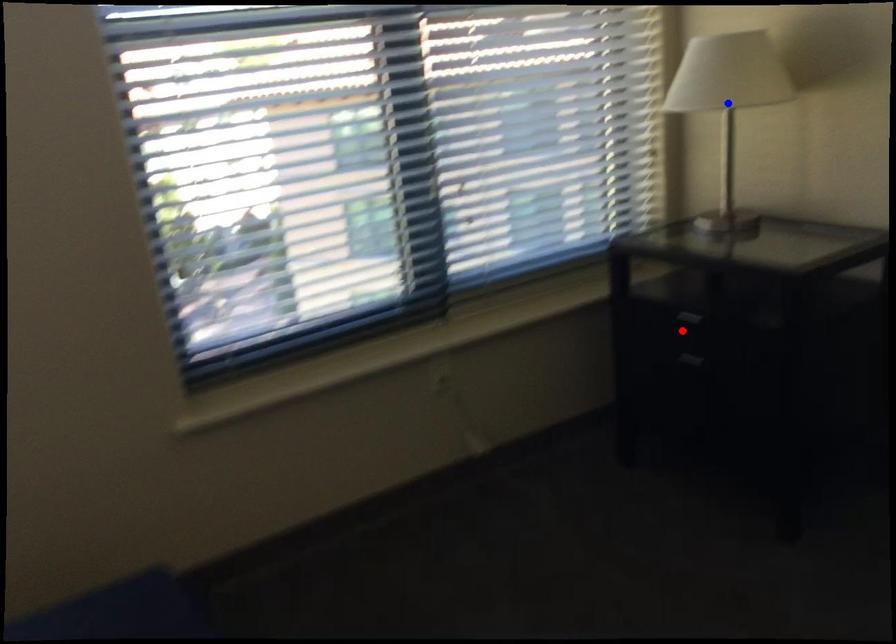
Question: Two points are marked on the image. Which point is closer to the camera?

Choices:
 (A) Blue point is closer.
 (B) Red point is closer.

Answer: (A)